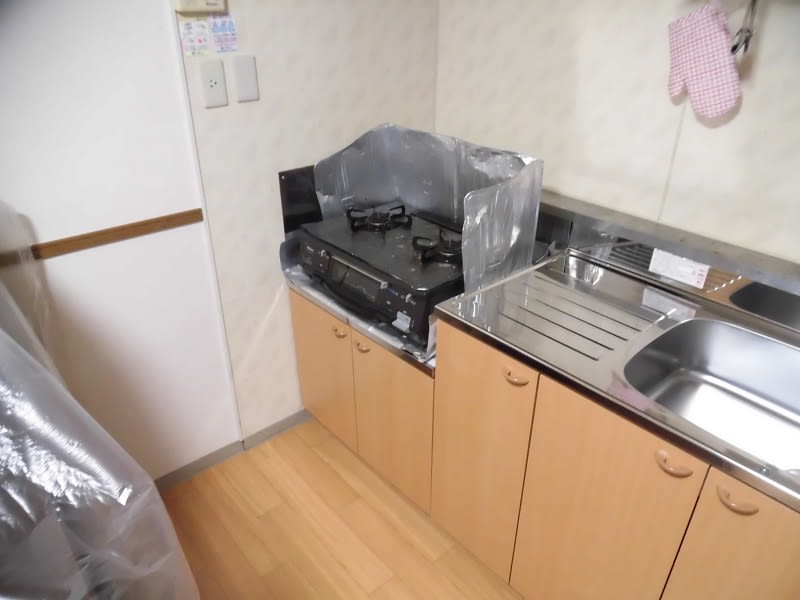
Find the location of a particular element. steel sink basin is located at coordinates click(x=708, y=356).